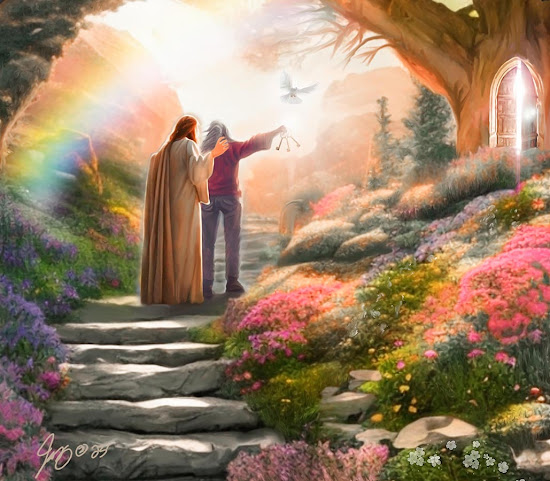
Locate an element on the screen. light is located at coordinates (519, 89), (219, 86).